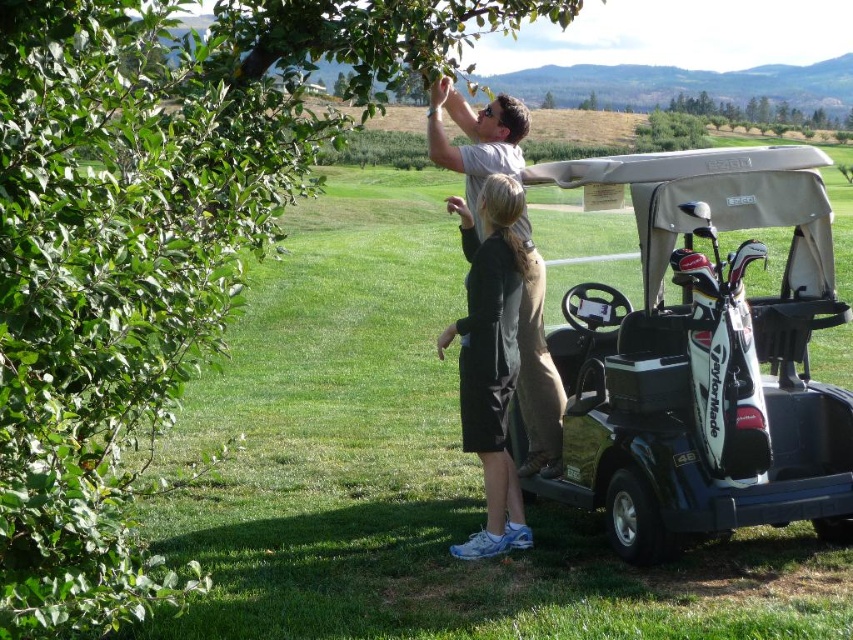
You are a golfer who wants to retrieve your black matte dress at center. You are currently standing near the black matte golf cart at center. Which direction should you move to reach the dress?

The black matte golf cart at center is closer to the viewer than the black matte dress at center, so you should move away from the golf cart towards the dress to reach it.